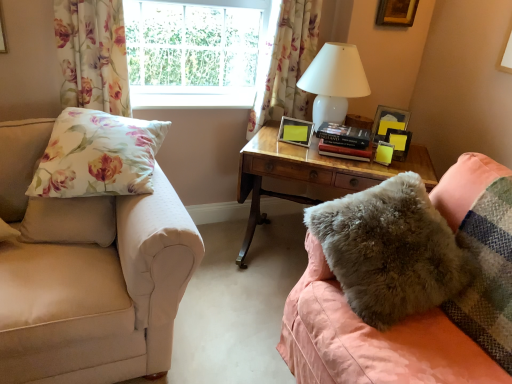
The image size is (512, 384). Identify the location of free region on the left part of hardcover book at center. (301, 151).